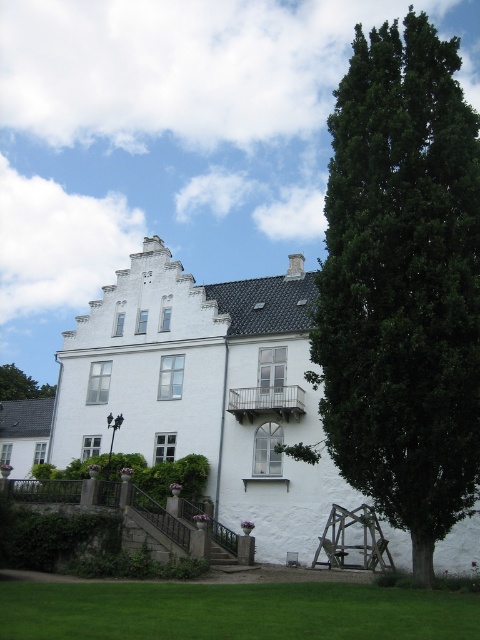
Is green leafy tree at right to the right of green leafy tree at upper left from the viewer's perspective?

Correct, you'll find green leafy tree at right to the right of green leafy tree at upper left.

Is green leafy tree at right wider than green leafy tree at upper left?

Yes.

Identify the location of green leafy tree at right. (403, 284).

Which of these two, green leafy tree at right or green grass at lower center, stands shorter?

green grass at lower center is shorter.

Measure the distance between point (427, 364) and camera.

A distance of 133.44 feet exists between point (427, 364) and camera.

Does point (410, 352) come in front of point (58, 595)?

Yes, point (410, 352) is closer to viewer.

This screenshot has width=480, height=640. In order to click on green leafy tree at right in this screenshot , I will do `click(403, 284)`.

Does green grass at lower center have a lesser width compared to green leafy tree at upper left?

No.

Measure the distance from green grass at lower center to green leafy tree at upper left.

They are 83.49 meters apart.

Which is in front, point (143, 616) or point (10, 365)?

Positioned in front is point (143, 616).

I want to click on green grass at lower center, so click(x=232, y=611).